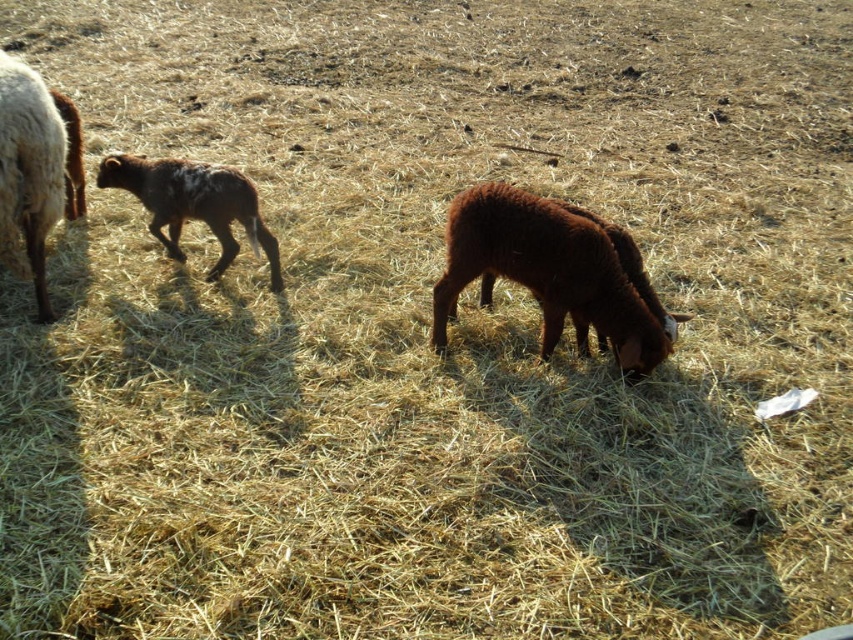
Question: Is brown woolen lamb at center closer to the viewer compared to white woolen sheep at left?

Choices:
 (A) yes
 (B) no

Answer: (B)

Question: Does brown woolen lamb at center have a greater width compared to speckled brown lamb at left?

Choices:
 (A) no
 (B) yes

Answer: (A)

Question: From the image, what is the correct spatial relationship of white woolen sheep at left in relation to speckled brown lamb at left?

Choices:
 (A) above
 (B) below

Answer: (A)

Question: Which point is closer to the camera?

Choices:
 (A) (233, 243)
 (B) (434, 308)

Answer: (B)

Question: Which of the following is the farthest from the observer?

Choices:
 (A) speckled brown lamb at left
 (B) brown woolen lamb at center
 (C) white woolen sheep at left

Answer: (A)

Question: Among these objects, which one is nearest to the camera?

Choices:
 (A) brown woolen lamb at center
 (B) white woolen sheep at left

Answer: (B)